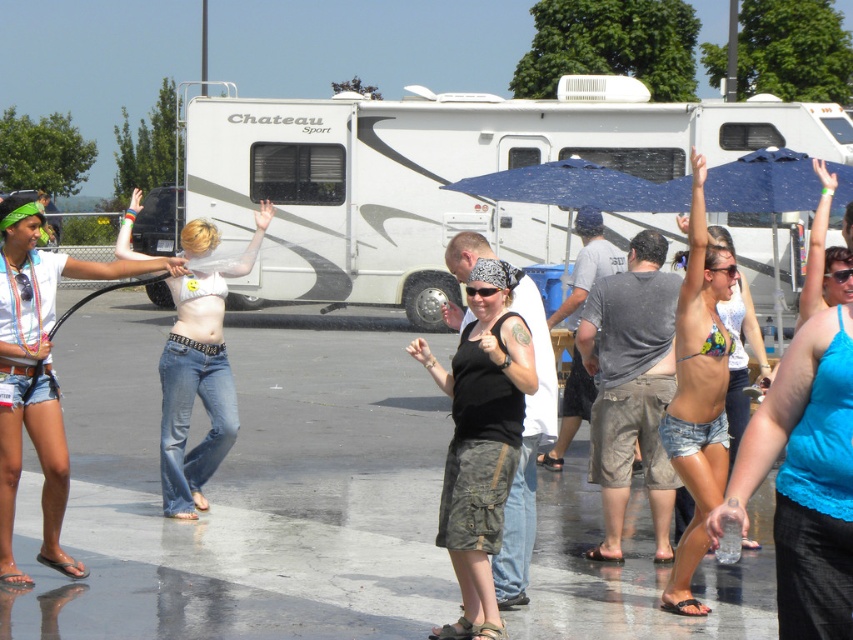
Question: Which object is closer to the camera taking this photo?

Choices:
 (A) printed bikini top at center
 (B) denim jeans at center

Answer: (A)

Question: In this image, where is blue lace tank top at upper right located relative to denim shorts at lower left?

Choices:
 (A) below
 (B) above

Answer: (A)

Question: Estimate the real-world distances between objects in this image. Which object is farther from the blue lace tank top at upper right?

Choices:
 (A) printed bikini top at center
 (B) black cotton tank top at center
 (C) denim shorts at lower left

Answer: (C)

Question: Does white glossy recreational vehicle at center have a greater width compared to printed bikini top at center?

Choices:
 (A) no
 (B) yes

Answer: (B)

Question: Which of the following is the closest to the observer?

Choices:
 (A) blue lace tank top at upper right
 (B) denim shorts at lower left
 (C) white glossy recreational vehicle at center

Answer: (A)

Question: Considering the relative positions of white glossy recreational vehicle at center and blue lace tank top at upper right in the image provided, where is white glossy recreational vehicle at center located with respect to blue lace tank top at upper right?

Choices:
 (A) below
 (B) above

Answer: (B)